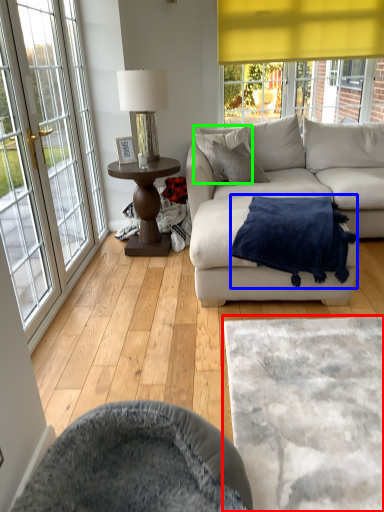
Question: Based on their relative distances, which object is farther from cat bed (highlighted by a red box)? Choose from blanket (highlighted by a blue box) and pillow (highlighted by a green box).

Choices:
 (A) blanket
 (B) pillow

Answer: (B)